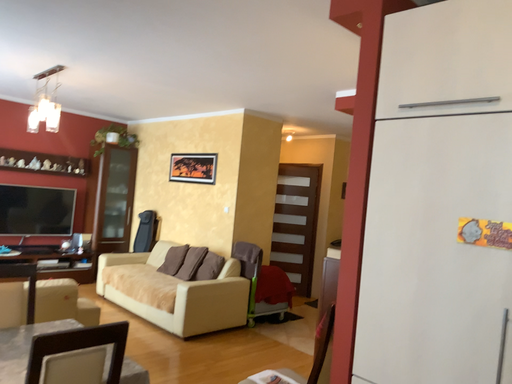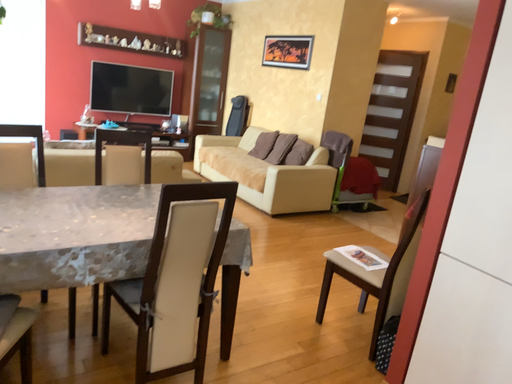
Question: How did the camera likely rotate when shooting the video?

Choices:
 (A) rotated left
 (B) rotated right

Answer: (A)